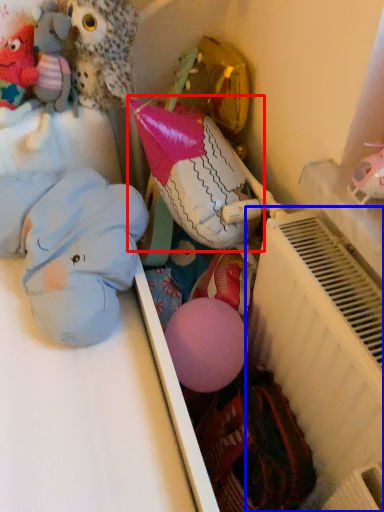
Question: Which point is closer to the camera, toy (highlighted by a red box) or radiator (highlighted by a blue box)?

Choices:
 (A) toy
 (B) radiator

Answer: (B)